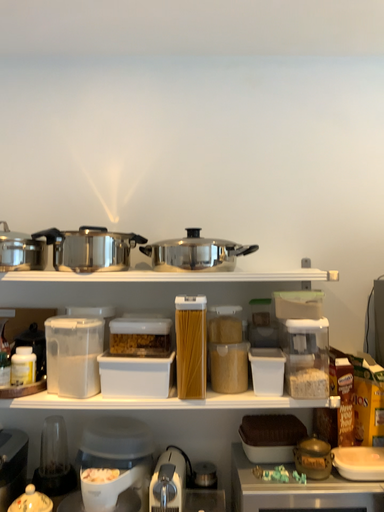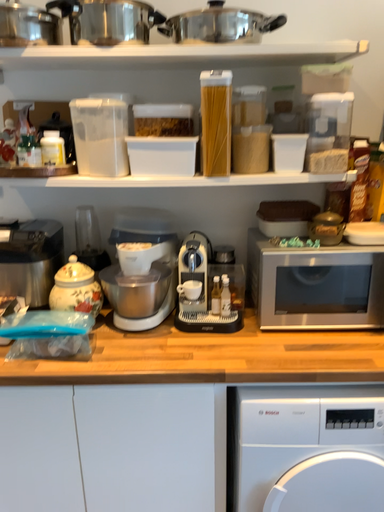
Question: How did the camera likely rotate when shooting the video?

Choices:
 (A) rotated upward
 (B) rotated downward

Answer: (B)